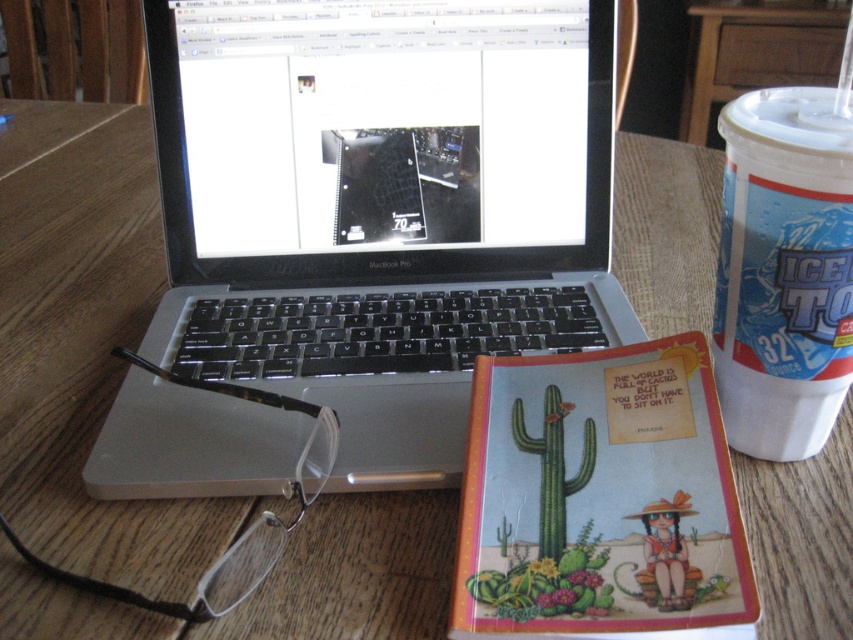
Is white paper cup at right above green matte cactus at center?

Yes.

Locate an element on the screen. This screenshot has height=640, width=853. white paper cup at right is located at coordinates (782, 272).

Describe the element at coordinates (782, 272) in the screenshot. I see `white paper cup at right` at that location.

The image size is (853, 640). In order to click on white paper cup at right in this screenshot , I will do `click(782, 272)`.

Is silver/black plastic laptop at center below green matte cactus at center?

No.

Can you confirm if silver/black plastic laptop at center is smaller than green matte cactus at center?

Incorrect, silver/black plastic laptop at center is not smaller in size than green matte cactus at center.

Locate an element on the screen. silver/black plastic laptop at center is located at coordinates (381, 205).

Is point (469, 20) behind point (808, 209)?

Yes.

In order to click on silver/black plastic laptop at center in this screenshot , I will do `click(381, 205)`.

The image size is (853, 640). What do you see at coordinates (381, 205) in the screenshot?
I see `silver/black plastic laptop at center` at bounding box center [381, 205].

Locate an element on the screen. The width and height of the screenshot is (853, 640). silver/black plastic laptop at center is located at coordinates (381, 205).